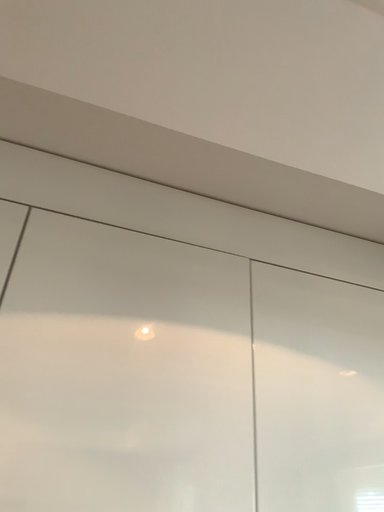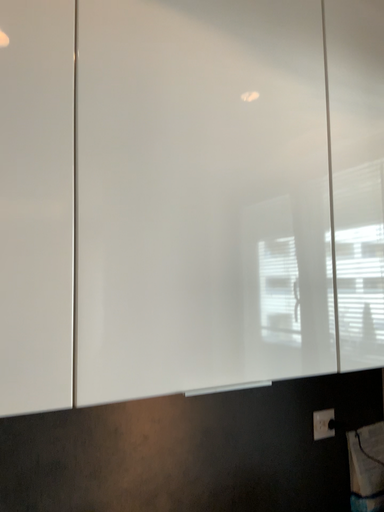
Question: How did the camera likely rotate when shooting the video?

Choices:
 (A) rotated right
 (B) rotated left

Answer: (A)